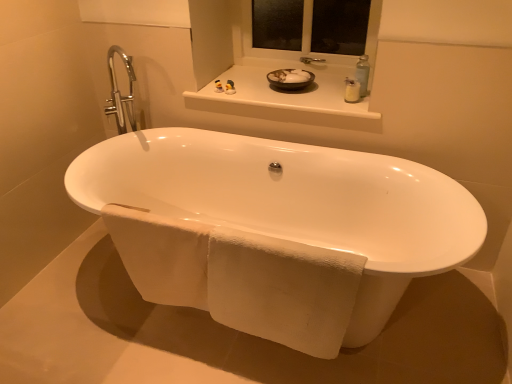
Question: Looking at their shapes, would you say white glossy bathtub at center is wider or thinner than white glossy window sill at upper center?

Choices:
 (A) thin
 (B) wide

Answer: (B)

Question: Considering the positions of point (240, 220) and point (279, 92), is point (240, 220) closer or farther from the camera than point (279, 92)?

Choices:
 (A) farther
 (B) closer

Answer: (A)

Question: Estimate the real-world distances between objects in this image. Which object is closer to the white plastic window frame at upper center?

Choices:
 (A) matte rubber duck at upper center, which appears as the 1th toiletry when viewed from the left
 (B) white plastic soap dispenser at upper right, the first toiletry when ordered from right to left
 (C) white glossy window sill at upper center
 (D) white textured towel at lower center
 (E) white glossy bowl at upper center

Answer: (E)

Question: Which of these objects is positioned farthest from the white plastic soap dispenser at upper right, the second toiletry in the back-to-front sequence?

Choices:
 (A) white glossy window sill at upper center
 (B) white plastic window frame at upper center
 (C) matte rubber duck at upper center, which is counted as the second toiletry, starting from the front
 (D) white textured towel at lower center
 (E) white glossy bowl at upper center

Answer: (D)